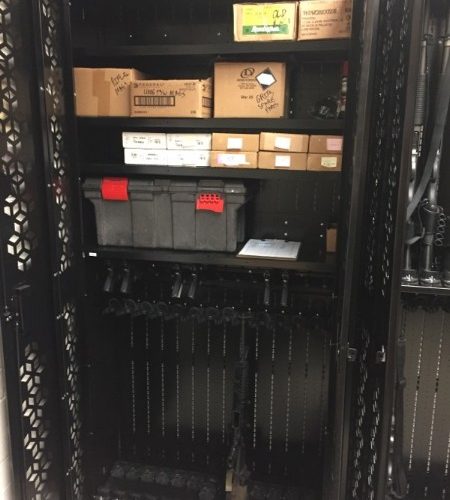
Image resolution: width=450 pixels, height=500 pixels. Find the location of `paper on clipboard`. paper on clipboard is located at coordinates (267, 247).